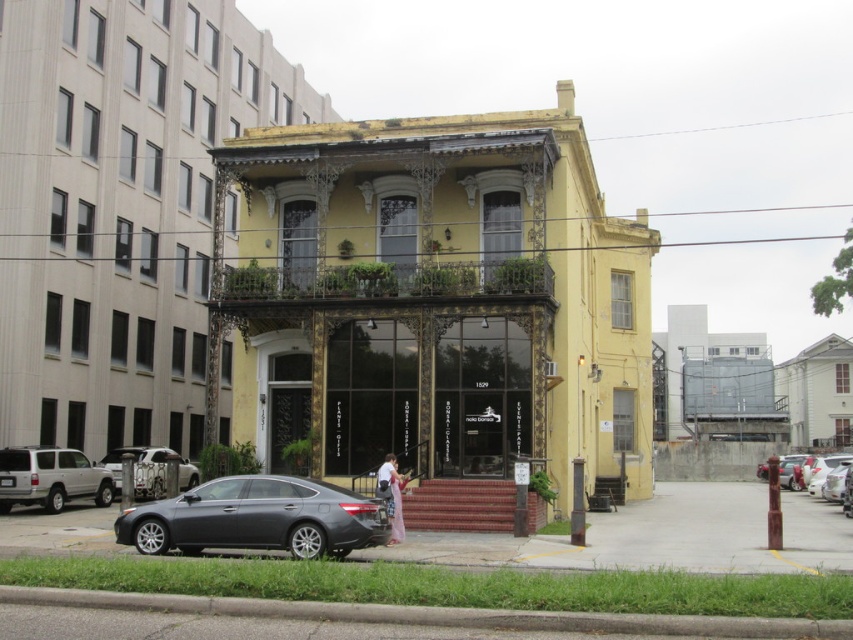
Question: Which point appears closest to the camera in this image?

Choices:
 (A) (184, 509)
 (B) (788, 467)

Answer: (A)

Question: Among these objects, which one is farthest from the camera?

Choices:
 (A) metallic silver car at lower left
 (B) silver metallic suv at lower left
 (C) pink fabric dress at lower center
 (D) white glossy car at lower right

Answer: (A)

Question: Does silver metallic suv at lower left have a greater width compared to pink fabric dress at lower center?

Choices:
 (A) no
 (B) yes

Answer: (B)

Question: Considering the real-world distances, which object is farthest from the white glossy car at lower right?

Choices:
 (A) pink fabric dress at lower center
 (B) silver metallic suv at lower left
 (C) satin gray sedan at lower left

Answer: (B)

Question: Is satin gray sedan at lower left smaller than white glossy car at lower right?

Choices:
 (A) no
 (B) yes

Answer: (B)

Question: Is the position of metallic silver car at lower left less distant than that of pink fabric dress at lower center?

Choices:
 (A) no
 (B) yes

Answer: (A)